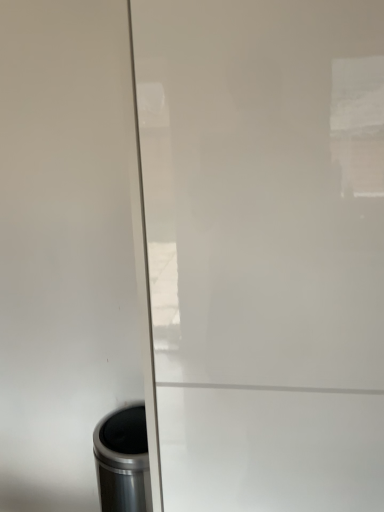
Question: Is white glossy screen door at center touching metallic trash can at lower left?

Choices:
 (A) yes
 (B) no

Answer: (B)

Question: Is white glossy screen door at center to the left of metallic trash can at lower left from the viewer's perspective?

Choices:
 (A) yes
 (B) no

Answer: (B)

Question: Considering the relative sizes of white glossy screen door at center and metallic trash can at lower left in the image provided, is white glossy screen door at center taller than metallic trash can at lower left?

Choices:
 (A) no
 (B) yes

Answer: (B)

Question: From a real-world perspective, is white glossy screen door at center over metallic trash can at lower left?

Choices:
 (A) yes
 (B) no

Answer: (A)

Question: Does white glossy screen door at center contain metallic trash can at lower left?

Choices:
 (A) no
 (B) yes

Answer: (A)

Question: From the image's perspective, would you say white glossy screen door at center is shown under metallic trash can at lower left?

Choices:
 (A) no
 (B) yes

Answer: (A)

Question: Is metallic trash can at lower left oriented away from white glossy screen door at center?

Choices:
 (A) no
 (B) yes

Answer: (A)

Question: Can you confirm if metallic trash can at lower left is taller than white glossy screen door at center?

Choices:
 (A) yes
 (B) no

Answer: (B)

Question: Considering the relative sizes of metallic trash can at lower left and white glossy screen door at center in the image provided, is metallic trash can at lower left smaller than white glossy screen door at center?

Choices:
 (A) yes
 (B) no

Answer: (A)

Question: From a real-world perspective, is metallic trash can at lower left under white glossy screen door at center?

Choices:
 (A) yes
 (B) no

Answer: (A)

Question: Is metallic trash can at lower left not near white glossy screen door at center?

Choices:
 (A) yes
 (B) no

Answer: (B)

Question: From a real-world perspective, is metallic trash can at lower left on top of white glossy screen door at center?

Choices:
 (A) yes
 (B) no

Answer: (B)

Question: Is white glossy screen door at center taller or shorter than metallic trash can at lower left?

Choices:
 (A) tall
 (B) short

Answer: (A)